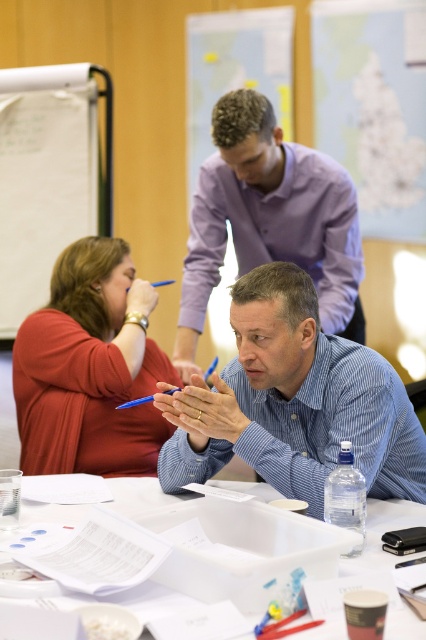
Based on the coordinates provided, which object is located at point (293,403) in the scene?

The point at (293,403) corresponds to the blue button down shirt at center.